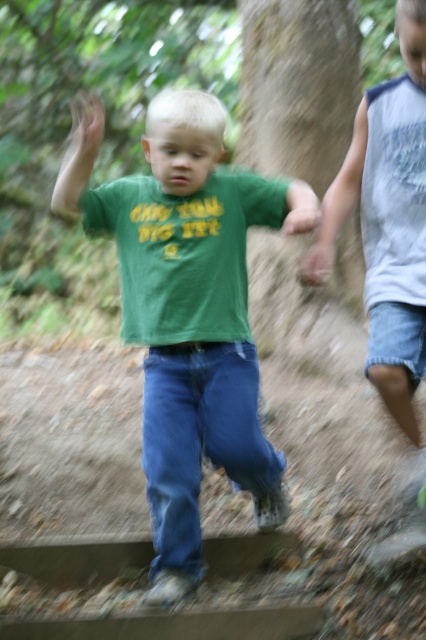
Can you confirm if green matte shirt at center is wider than gray sleeveless shirt at right?

Indeed, green matte shirt at center has a greater width compared to gray sleeveless shirt at right.

What do you see at coordinates (187, 310) in the screenshot? This screenshot has width=426, height=640. I see `green matte shirt at center` at bounding box center [187, 310].

Find the location of a particular element. The height and width of the screenshot is (640, 426). green matte shirt at center is located at coordinates (187, 310).